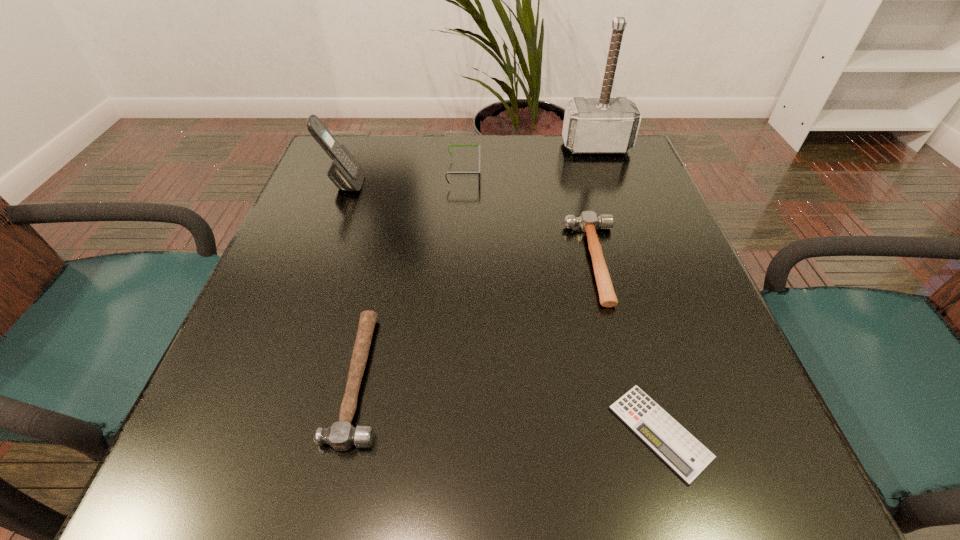
Image resolution: width=960 pixels, height=540 pixels. What are the coordinates of `free space located for striking with the head of the farthest object` in the screenshot? It's located at pos(614,198).

Locate an element on the screen. The height and width of the screenshot is (540, 960). vacant point located on the front-facing side of the fifth shortest object is located at coordinates (431, 184).

Where is `vacant region located on the lens of the fourth object from right to left`? vacant region located on the lens of the fourth object from right to left is located at coordinates (588, 173).

Find the location of `free space located on the left of the second nearest hammer`. free space located on the left of the second nearest hammer is located at coordinates (424, 261).

Image resolution: width=960 pixels, height=540 pixels. I want to click on free space located on the striking face of the leftmost hammer, so click(x=476, y=377).

Where is `blank area located 0.230m on the back of the calculator`? This screenshot has width=960, height=540. blank area located 0.230m on the back of the calculator is located at coordinates (614, 276).

Identify the location of hammer located in the far edge section of the desktop. The width and height of the screenshot is (960, 540). (604, 125).

This screenshot has width=960, height=540. I want to click on cellular telephone that is at the far edge, so click(x=345, y=172).

Identify the location of spectacles that is at the far edge. (449, 145).

The width and height of the screenshot is (960, 540). In order to click on hammer located at the near edge in this screenshot , I will do `click(342, 435)`.